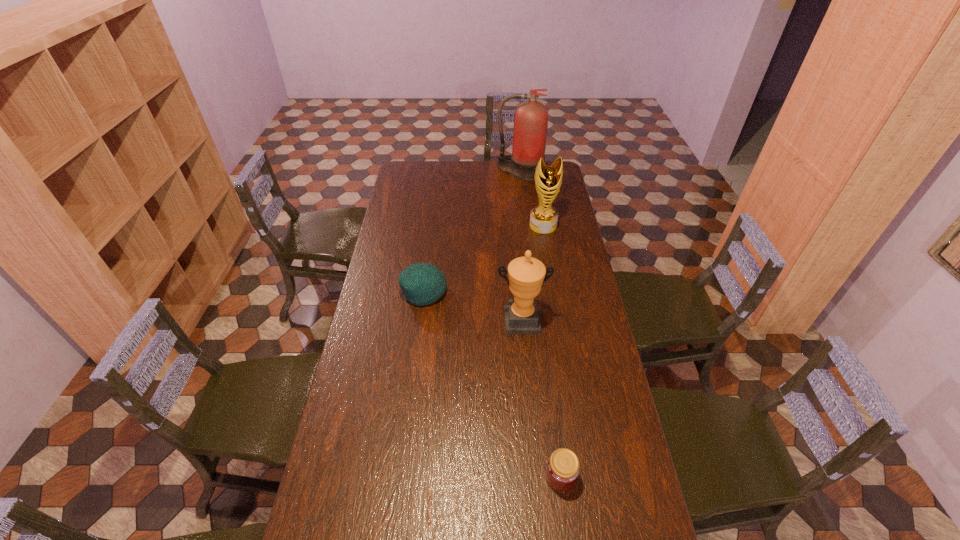
Select which object appears as the closest to the nearer award. Please provide its 2D coordinates. Your answer should be formatted as a tuple, i.e. [(x, y)], where the tuple contains the x and y coordinates of a point satisfying the conditions above.

[(422, 283)]

Identify the location of vacant point that satisfies the following two spatial constraints: 1. at the front of the nearer award with handles; 2. on the left side of the jam. Image resolution: width=960 pixels, height=540 pixels. (535, 477).

Find the location of a particular element. This screenshot has height=540, width=960. free space that satisfies the following two spatial constraints: 1. at the front of the nearest object with handles; 2. on the right side of the nearer award is located at coordinates (535, 477).